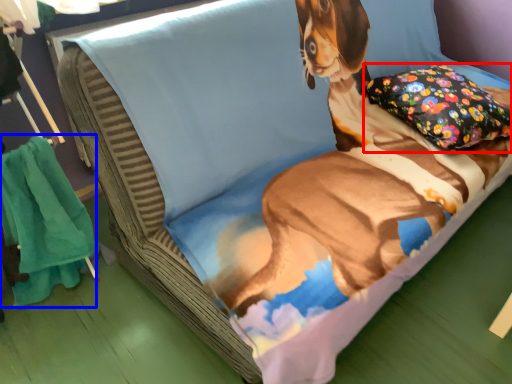
Question: Which point is further to the camera, pillow (highlighted by a red box) or blanket (highlighted by a blue box)?

Choices:
 (A) pillow
 (B) blanket

Answer: (A)